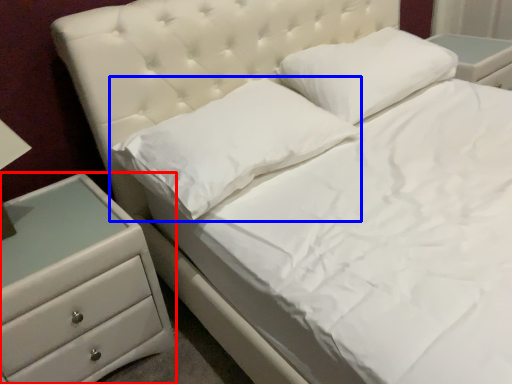
Question: Among these objects, which one is nearest to the camera, chest of drawers (highlighted by a red box) or pillow (highlighted by a blue box)?

Choices:
 (A) chest of drawers
 (B) pillow

Answer: (A)